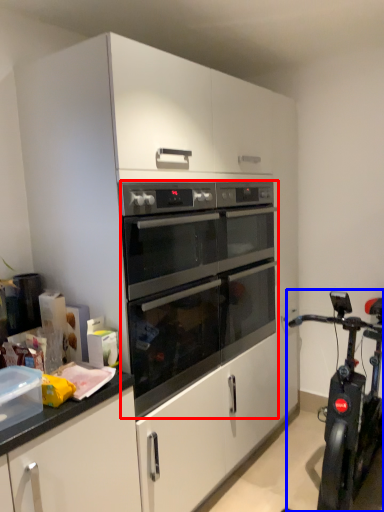
Question: Which object is closer to the camera taking this photo, oven (highlighted by a red box) or stationary bicycle (highlighted by a blue box)?

Choices:
 (A) oven
 (B) stationary bicycle

Answer: (B)